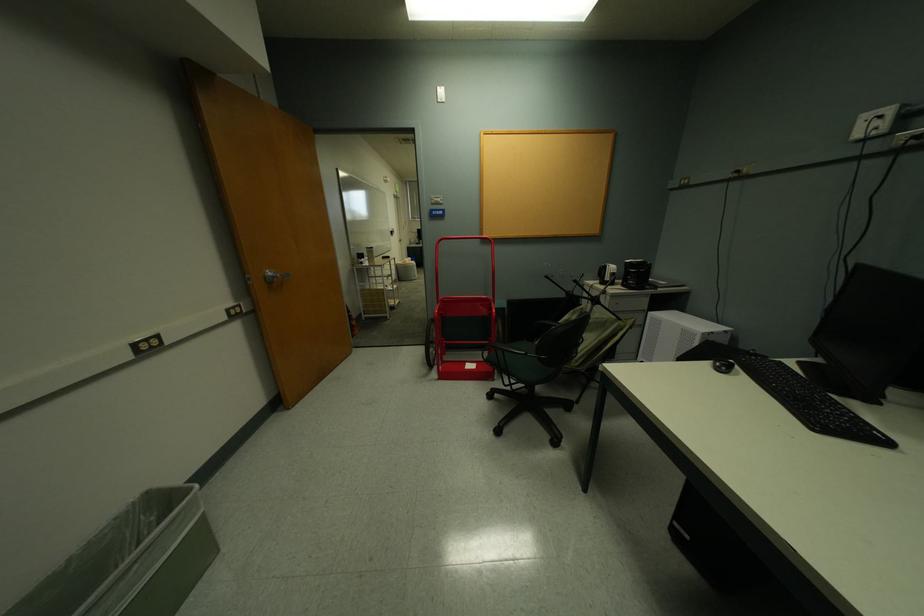
Which object does [131,561] point to?

It corresponds to the grey trash can in the image.